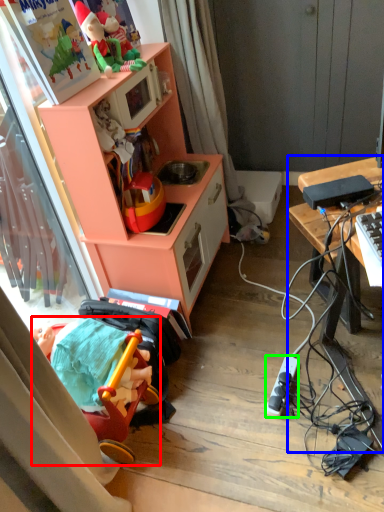
Question: Considering the real-world distances, which object is farthest from toy (highlighted by a red box)? desk (highlighted by a blue box) or appliance (highlighted by a green box)?

Choices:
 (A) desk
 (B) appliance

Answer: (A)